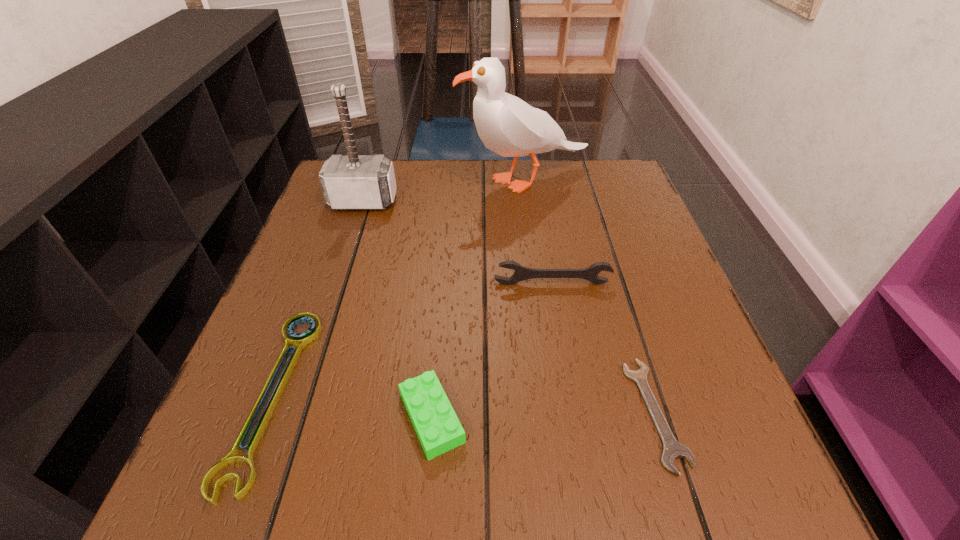
Find the location of a particular element. vacant area in the image that satisfies the following two spatial constraints: 1. on the open ends of the third tallest object; 2. on the right side of the shortest wrench is located at coordinates (574, 413).

In order to click on blank space that satisfies the following two spatial constraints: 1. for striking with the head of the shortest object; 2. on the right side of the hammer in this screenshot , I will do `click(293, 413)`.